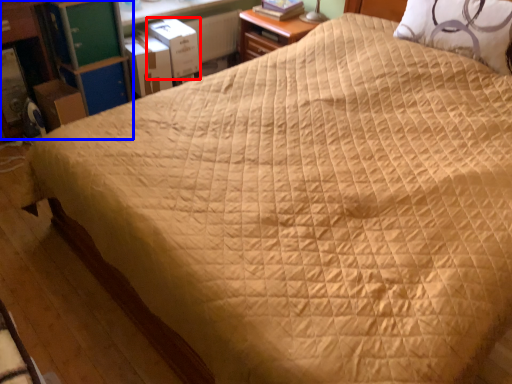
Question: Among these objects, which one is nearest to the camera, cardboard box (highlighted by a red box) or dresser (highlighted by a blue box)?

Choices:
 (A) cardboard box
 (B) dresser

Answer: (B)